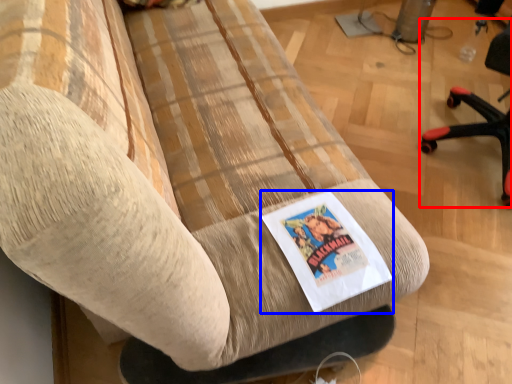
Question: Among these objects, which one is nearest to the camera, chair (highlighted by a red box) or flyer (highlighted by a blue box)?

Choices:
 (A) chair
 (B) flyer

Answer: (B)